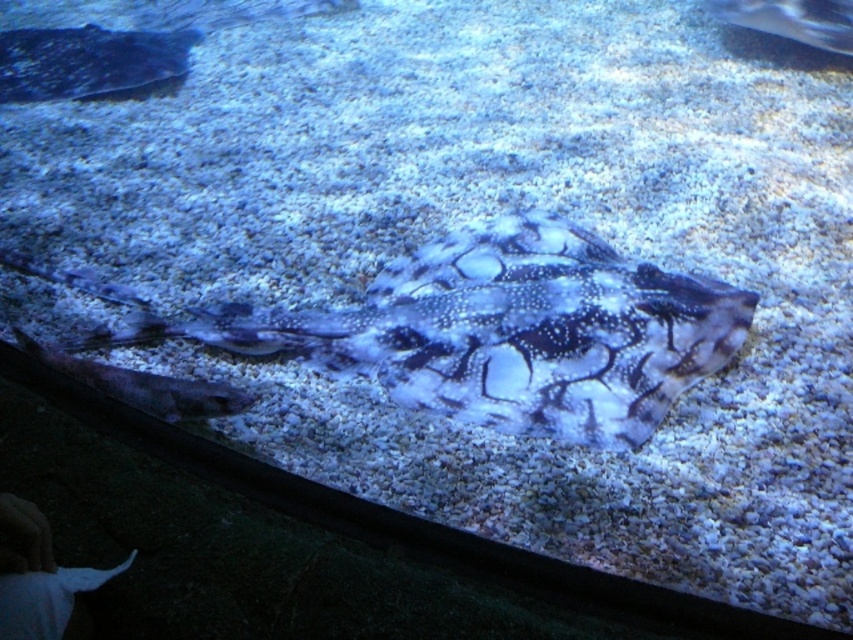
Question: Which point appears closest to the camera in this image?

Choices:
 (A) (827, 35)
 (B) (548, 317)
 (C) (88, 371)

Answer: (C)

Question: Which point appears farthest from the camera in this image?

Choices:
 (A) (817, 22)
 (B) (225, 394)

Answer: (A)

Question: Can you confirm if speckled skin ray at center is thinner than speckled skin ray at upper right?

Choices:
 (A) no
 (B) yes

Answer: (A)

Question: Does speckled skin ray at center appear on the right side of speckled skin ray at upper right?

Choices:
 (A) yes
 (B) no

Answer: (B)

Question: Can you confirm if speckled skin ray at center is positioned to the right of speckled skin fish at center?

Choices:
 (A) no
 (B) yes

Answer: (B)

Question: Among these objects, which one is farthest from the camera?

Choices:
 (A) speckled skin ray at center
 (B) speckled skin ray at upper right

Answer: (B)